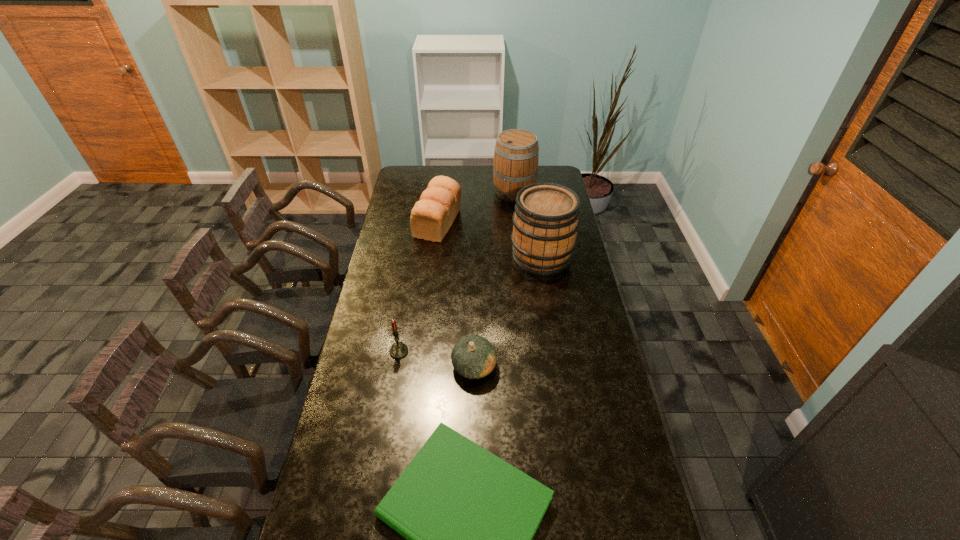
The image size is (960, 540). Identify the location of object at the far edge. (516, 155).

The height and width of the screenshot is (540, 960). Find the location of `bread positioned at the left edge`. bread positioned at the left edge is located at coordinates (432, 216).

This screenshot has height=540, width=960. Find the location of `candle that is at the left edge`. candle that is at the left edge is located at coordinates (398, 350).

Where is `object positioned at the far right corner`? This screenshot has height=540, width=960. object positioned at the far right corner is located at coordinates (516, 155).

In the image, there is a desktop. Where is `vacant space at the far edge`? The width and height of the screenshot is (960, 540). vacant space at the far edge is located at coordinates (492, 170).

Locate an element on the screen. The height and width of the screenshot is (540, 960). vacant space at the left edge of the desktop is located at coordinates (366, 323).

Where is `vacant space at the right edge`? This screenshot has height=540, width=960. vacant space at the right edge is located at coordinates (557, 297).

Identify the location of vacant space at the far left corner of the desktop. Image resolution: width=960 pixels, height=540 pixels. tap(419, 176).

Locate an element on the screen. The width and height of the screenshot is (960, 540). vacant space in between the gourd and the nearer cider is located at coordinates (508, 312).

Find the location of a particular element. free point between the gourd and the bread is located at coordinates (456, 294).